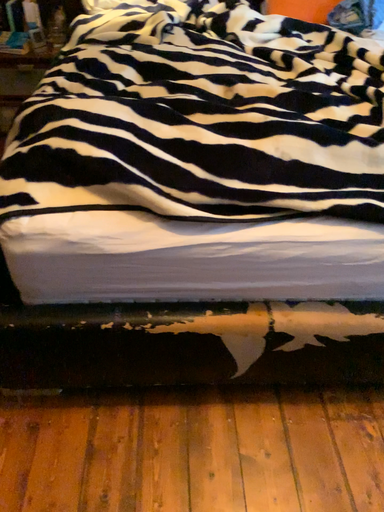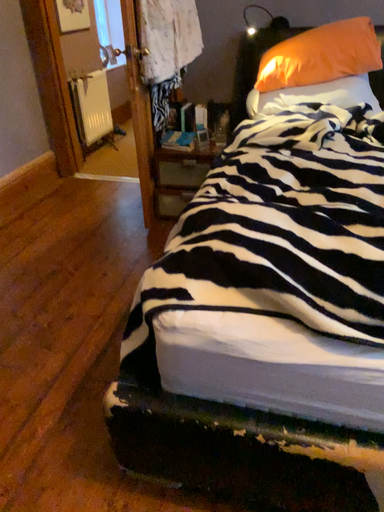
Question: Which way did the camera rotate in the video?

Choices:
 (A) rotated left
 (B) rotated right

Answer: (A)